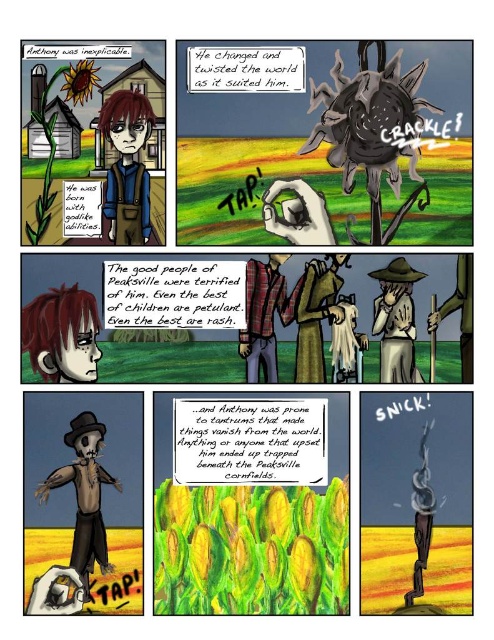
Question: Does matte brown hair at center appear on the left side of brown straw hat at center?

Choices:
 (A) yes
 (B) no

Answer: (A)

Question: Which object appears closest to the camera in this image?

Choices:
 (A) wooden stick at center
 (B) wooden scarecrow at lower left
 (C) shiny red hair at center

Answer: (B)

Question: Is brown straw hat at center behind green fabric dress at center?

Choices:
 (A) no
 (B) yes

Answer: (A)

Question: Does wooden scarecrow at lower left have a greater width compared to green fabric dress at center?

Choices:
 (A) yes
 (B) no

Answer: (A)

Question: Among these objects, which one is nearest to the camera?

Choices:
 (A) plaid fabric shirt at center
 (B) wooden scarecrow at lower left
 (C) matte brown hair at center

Answer: (B)

Question: Which of these objects is positioned closest to the green fabric dress at center?

Choices:
 (A) brown straw hat at center
 (B) wooden scarecrow at lower left

Answer: (A)